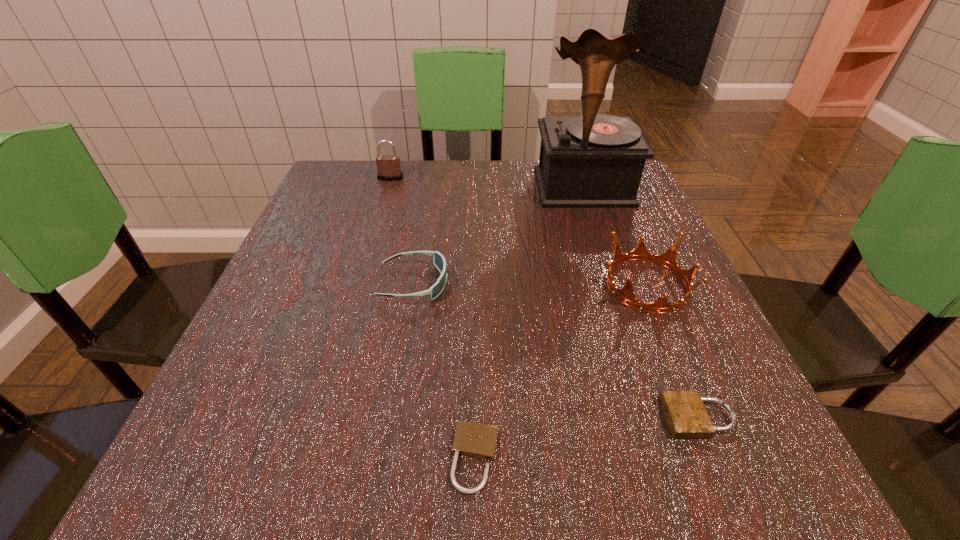
Find the location of a particular element. This screenshot has height=540, width=960. blank space at the right edge of the desktop is located at coordinates click(x=616, y=267).

What are the coordinates of `free spot between the second shortest padlock and the fourth shortest object` in the screenshot? It's located at (673, 351).

In order to click on unoccupied area between the goggles and the rightmost padlock in this screenshot , I will do `click(556, 350)`.

I want to click on free spot between the second tallest padlock and the fifth shortest object, so click(544, 298).

Where is `free point between the shortest object and the rightmost padlock`? free point between the shortest object and the rightmost padlock is located at coordinates (587, 438).

The image size is (960, 540). What are the coordinates of `free spot between the leftmost object and the fourth shortest object` in the screenshot? It's located at (518, 231).

Where is `free space that is in between the fourth tallest object and the shortest padlock`? free space that is in between the fourth tallest object and the shortest padlock is located at coordinates (444, 371).

Find the location of a particular element. This screenshot has height=540, width=960. the third closest object to the goggles is located at coordinates (626, 295).

Choose which object is the third nearest neighbor to the second padlock from left to right. Please provide its 2D coordinates. Your answer should be formatted as a tuple, i.e. [(x, y)], where the tuple contains the x and y coordinates of a point satisfying the conditions above.

[(626, 295)]

Where is `padlock that can be found as the closest to the tallest object`? This screenshot has height=540, width=960. padlock that can be found as the closest to the tallest object is located at coordinates (388, 166).